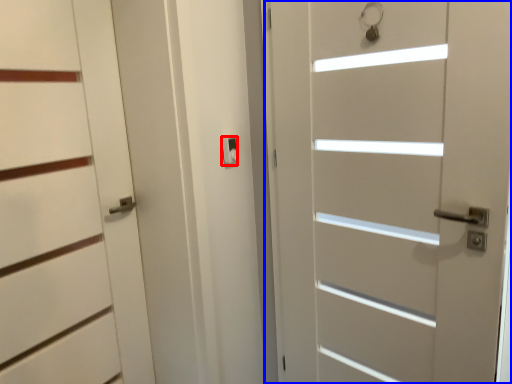
Question: Which object appears farthest to the camera in this image, latch (highlighted by a red box) or door (highlighted by a blue box)?

Choices:
 (A) latch
 (B) door

Answer: (A)